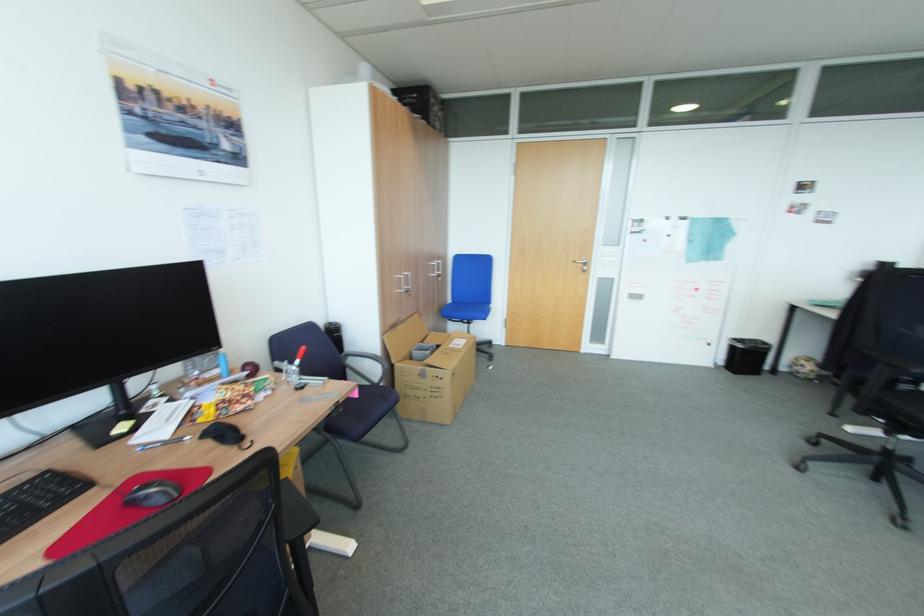
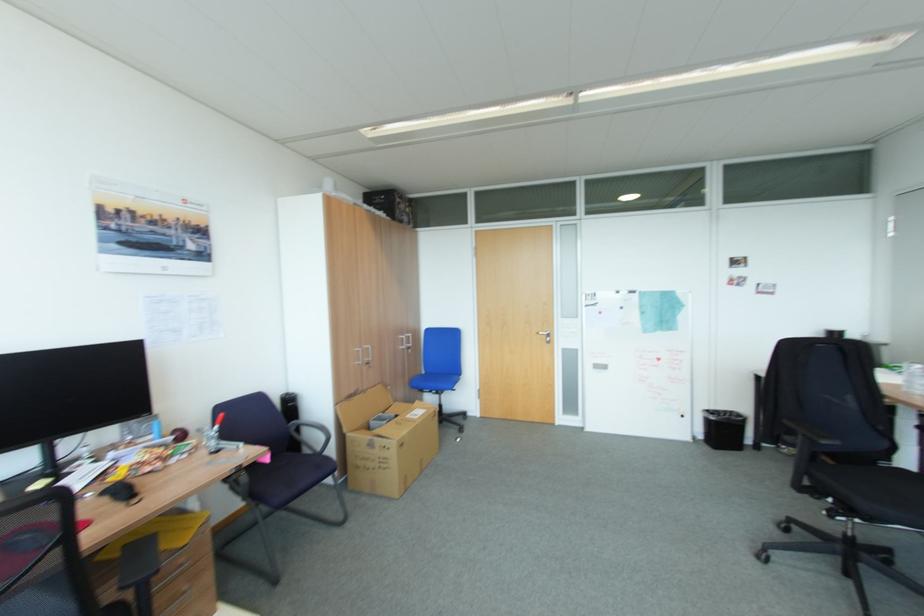
Question: The images are taken continuously from a first-person perspective. In which direction is your viewpoint rotating?

Choices:
 (A) Left
 (B) Right
 (C) Up
 (D) Down

Answer: (C)